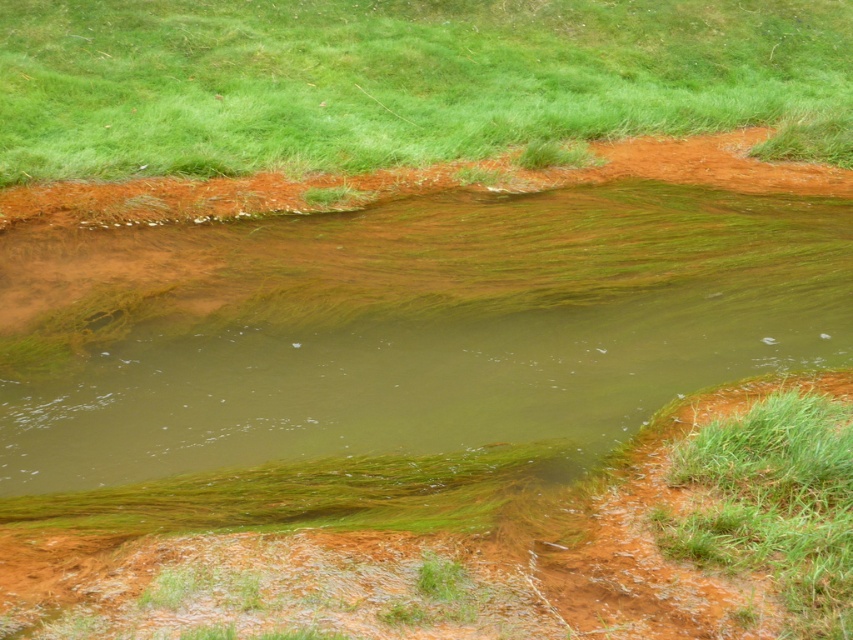
Question: In this image, where is green grassy at upper center located relative to green grassy at lower right?

Choices:
 (A) below
 (B) above

Answer: (B)

Question: Can you confirm if green grassy at upper center is positioned above green grassy at lower right?

Choices:
 (A) yes
 (B) no

Answer: (A)

Question: Which point is closer to the camera taking this photo?

Choices:
 (A) (352, 83)
 (B) (761, 413)

Answer: (B)

Question: Which point is farther to the camera?

Choices:
 (A) (695, 99)
 (B) (746, 412)

Answer: (A)

Question: Does green grassy at upper center have a larger size compared to green grassy at lower right?

Choices:
 (A) no
 (B) yes

Answer: (B)

Question: Which point is closer to the camera?

Choices:
 (A) (364, 76)
 (B) (782, 468)

Answer: (B)